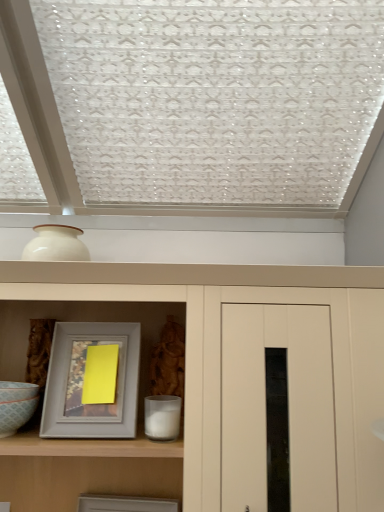
Question: From a real-world perspective, is gray matte picture frame at center, the 1th picture frame when ordered from top to bottom, positioned under matte gray picture frame at lower center, the second picture frame viewed from the top, based on gravity?

Choices:
 (A) yes
 (B) no

Answer: (B)

Question: Is the position of gray matte picture frame at center, the 1th picture frame when ordered from top to bottom, more distant than that of matte gray picture frame at lower center, the 1th picture frame positioned from the bottom?

Choices:
 (A) no
 (B) yes

Answer: (A)

Question: Is gray matte picture frame at center, which is counted as the 2th picture frame, starting from the bottom, not within matte gray picture frame at lower center, the second picture frame viewed from the top?

Choices:
 (A) no
 (B) yes

Answer: (B)

Question: Considering the relative sizes of gray matte picture frame at center, which is counted as the 2th picture frame, starting from the bottom, and matte gray picture frame at lower center, the 1th picture frame positioned from the bottom, in the image provided, is gray matte picture frame at center, which is counted as the 2th picture frame, starting from the bottom, smaller than matte gray picture frame at lower center, the 1th picture frame positioned from the bottom,?

Choices:
 (A) yes
 (B) no

Answer: (B)

Question: Is gray matte picture frame at center, which is counted as the 2th picture frame, starting from the bottom, to the left of matte gray picture frame at lower center, the second picture frame viewed from the top, from the viewer's perspective?

Choices:
 (A) yes
 (B) no

Answer: (A)

Question: Do you think gray matte picture frame at center, which is counted as the 2th picture frame, starting from the bottom, is within matte gray picture frame at lower center, the second picture frame viewed from the top, or outside of it?

Choices:
 (A) inside
 (B) outside

Answer: (B)

Question: Does point (96, 418) appear closer or farther from the camera than point (165, 505)?

Choices:
 (A) farther
 (B) closer

Answer: (B)

Question: In terms of size, does gray matte picture frame at center, the 1th picture frame when ordered from top to bottom, appear bigger or smaller than matte gray picture frame at lower center, the second picture frame viewed from the top?

Choices:
 (A) small
 (B) big

Answer: (B)

Question: From their relative heights in the image, would you say gray matte picture frame at center, the 1th picture frame when ordered from top to bottom, is taller or shorter than matte gray picture frame at lower center, the second picture frame viewed from the top?

Choices:
 (A) short
 (B) tall

Answer: (B)

Question: From their relative heights in the image, would you say matte white cupboard at center is taller or shorter than matte gray picture frame at lower center, the second picture frame viewed from the top?

Choices:
 (A) tall
 (B) short

Answer: (A)

Question: Considering the positions of matte white cupboard at center and matte gray picture frame at lower center, the second picture frame viewed from the top, in the image, is matte white cupboard at center wider or thinner than matte gray picture frame at lower center, the second picture frame viewed from the top,?

Choices:
 (A) wide
 (B) thin

Answer: (A)

Question: Considering the relative positions of matte white cupboard at center and matte gray picture frame at lower center, the second picture frame viewed from the top, in the image provided, is matte white cupboard at center to the left or to the right of matte gray picture frame at lower center, the second picture frame viewed from the top,?

Choices:
 (A) right
 (B) left

Answer: (A)

Question: Based on their sizes in the image, would you say matte white cupboard at center is bigger or smaller than matte gray picture frame at lower center, the 1th picture frame positioned from the bottom?

Choices:
 (A) big
 (B) small

Answer: (A)

Question: Does point (135, 509) appear closer or farther from the camera than point (13, 407)?

Choices:
 (A) closer
 (B) farther

Answer: (B)

Question: In terms of size, does matte gray picture frame at lower center, the 1th picture frame positioned from the bottom, appear bigger or smaller than matte white bowl at lower left?

Choices:
 (A) small
 (B) big

Answer: (B)